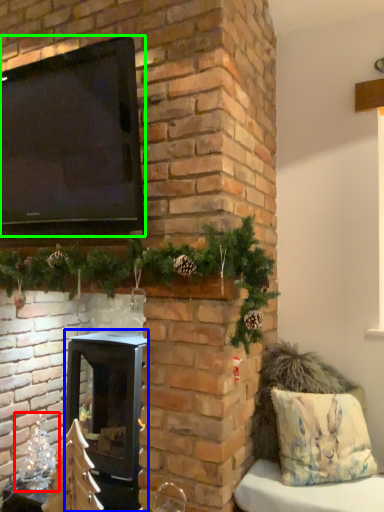
Question: Which object is the farthest from christmas decoration (highlighted by a red box)? Choose among these: wood burning stove (highlighted by a blue box) or window screen (highlighted by a green box).

Choices:
 (A) wood burning stove
 (B) window screen

Answer: (B)